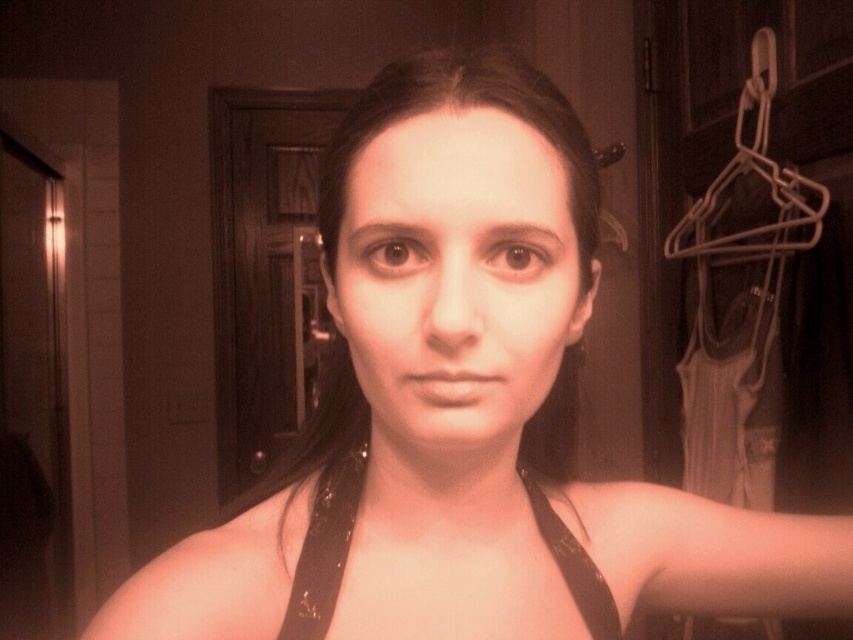
What are the exact coordinates of the smooth skin face at center in the image?

The smooth skin face at center is located at point coordinates of [457,276].

You are a photographer setting up a shoot in the bathroom scene described. You need to ensure that the smooth skin face at center and the white plastic hanger at upper right are both visible in the frame. Based on their sizes, which object should you focus on first to ensure proper framing?

The smooth skin face at center is shorter than the white plastic hanger at upper right, so you should focus on the white plastic hanger at upper right first to ensure it fits within the frame since it is taller.